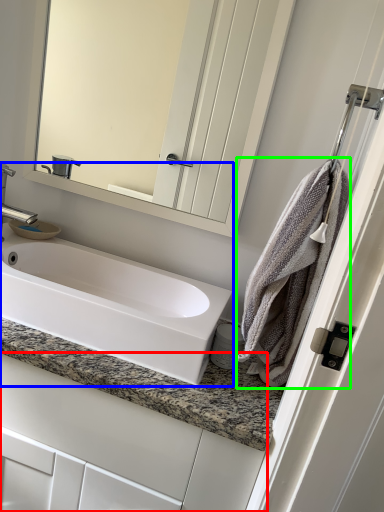
Question: Which object is positioned farthest from bathroom cabinet (highlighted by a red box)? Select from sink (highlighted by a blue box) and bath towel (highlighted by a green box).

Choices:
 (A) sink
 (B) bath towel

Answer: (B)